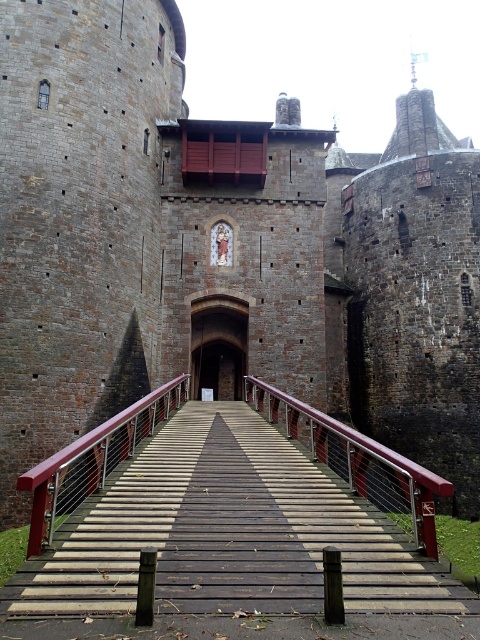
Question: Can you confirm if wooden bridge at center is positioned to the left of brown stone archway at center?

Choices:
 (A) no
 (B) yes

Answer: (A)

Question: Which point is closer to the camera?

Choices:
 (A) wooden bridge at center
 (B) brown stone archway at center

Answer: (A)

Question: Which point is farther from the camera taking this photo?

Choices:
 (A) (215, 378)
 (B) (377, 605)

Answer: (A)

Question: Which point is closer to the camera?

Choices:
 (A) (233, 550)
 (B) (232, 378)

Answer: (A)

Question: From the image, what is the correct spatial relationship of wooden bridge at center in relation to brown stone archway at center?

Choices:
 (A) above
 (B) below

Answer: (B)

Question: Observing the image, what is the correct spatial positioning of wooden bridge at center in reference to brown stone archway at center?

Choices:
 (A) left
 (B) right

Answer: (B)